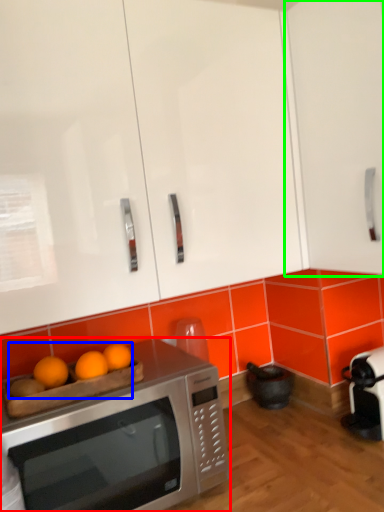
Question: Which object is the closest to the microwave oven (highlighted by a red box)? Choose among these: fruit (highlighted by a blue box) or cabinetry (highlighted by a green box).

Choices:
 (A) fruit
 (B) cabinetry

Answer: (A)